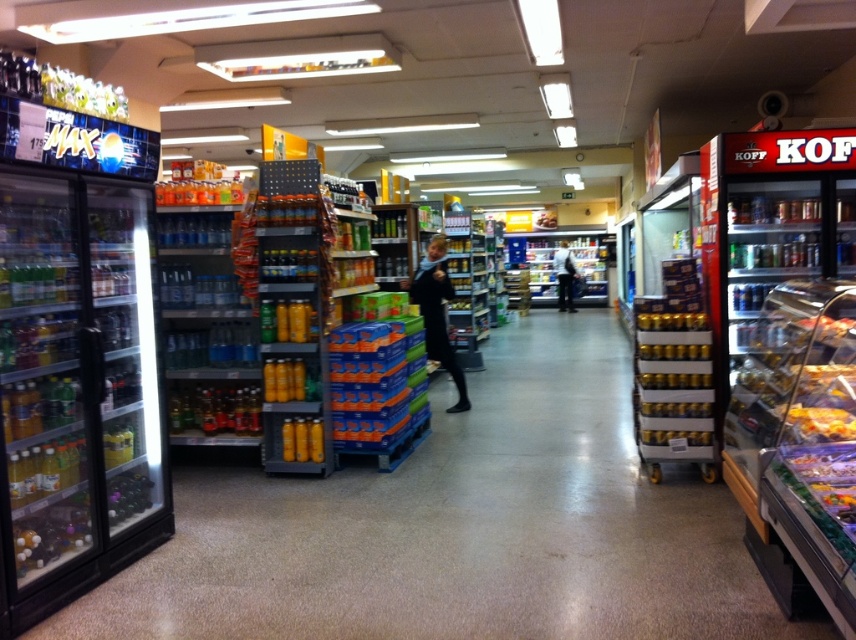
Who is positioned more to the left, yellow plastic baguette at center right or black leather jacket at center?

Positioned to the left is yellow plastic baguette at center right.

Is yellow plastic baguette at center right smaller than black leather jacket at center?

Yes, yellow plastic baguette at center right is smaller than black leather jacket at center.

Does point (847, 412) come in front of point (571, 301)?

That is True.

Where is `yellow plastic baguette at center right`? yellow plastic baguette at center right is located at coordinates pos(819,422).

Based on the photo, does yellow matte cans at center have a lesser height compared to yellow matte can at center?

In fact, yellow matte cans at center may be taller than yellow matte can at center.

Is point (673, 346) positioned after point (700, 444)?

Yes.

Where is `yellow matte cans at center`? This screenshot has height=640, width=856. yellow matte cans at center is located at coordinates (673, 352).

Which is below, black matte jacket at center or yellow matte canisters at center?

Positioned lower is yellow matte canisters at center.

Does point (431, 330) come behind point (675, 404)?

Yes, it is behind point (675, 404).

Find the location of `black matte jacket at center`. black matte jacket at center is located at coordinates (437, 314).